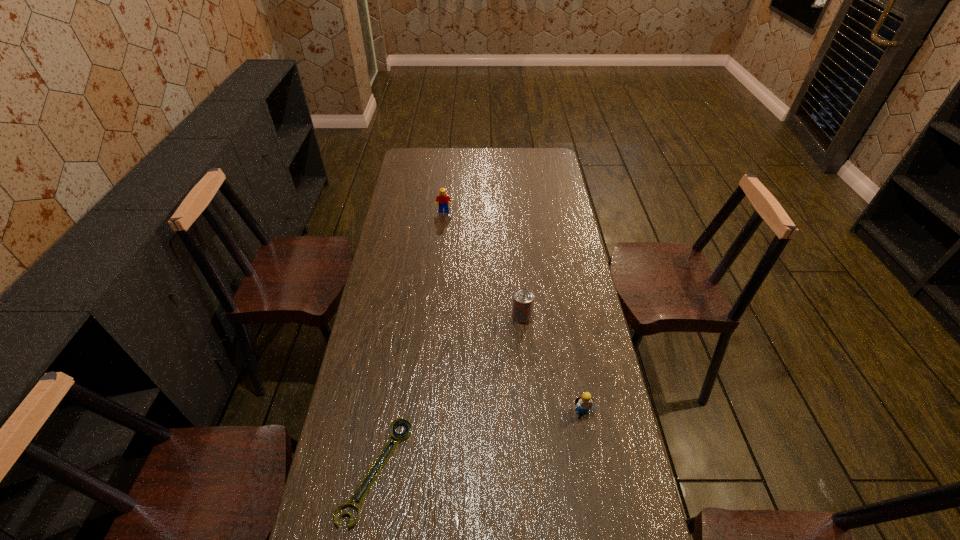
Locate an element on the screen. This screenshot has width=960, height=540. vacant region located on the front-facing side of the shorter Lego is located at coordinates (605, 535).

Find the location of `blank area located 0.390m on the back of the nearest object`. blank area located 0.390m on the back of the nearest object is located at coordinates (401, 314).

Locate an element on the screen. Image resolution: width=960 pixels, height=540 pixels. object that is at the left edge is located at coordinates (401, 421).

Locate an element on the screen. The width and height of the screenshot is (960, 540). object located in the right edge section of the desktop is located at coordinates (584, 401).

The image size is (960, 540). What are the coordinates of `vacant region at the far edge` in the screenshot? It's located at (470, 165).

In the image, there is a desktop. Find the location of `vacant space at the left edge`. vacant space at the left edge is located at coordinates (378, 307).

At what (x,y) coordinates should I click in order to perform the action: click on free space at the right edge of the desktop. Please return your answer as a coordinate pair (x, y). This screenshot has height=540, width=960. Looking at the image, I should click on (547, 190).

This screenshot has width=960, height=540. Find the location of `vacant point at the far right corner`. vacant point at the far right corner is located at coordinates (546, 150).

Image resolution: width=960 pixels, height=540 pixels. I want to click on empty space between the farthest object and the second object from right to left, so click(x=483, y=264).

Identify the location of blank region between the third nearest object and the farthest object. The image size is (960, 540). click(483, 264).